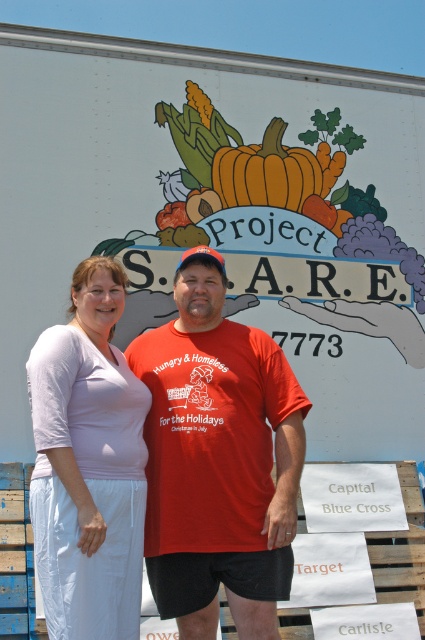
Which is above, pale pink fabric shirt at center or orange matte pumpkin at center?

orange matte pumpkin at center is above.

Is point (136, 576) positioned after point (294, 180)?

No.

Is point (30, 378) positioned in front of point (275, 170)?

Yes, point (30, 378) is closer to viewer.

The height and width of the screenshot is (640, 425). Identify the location of pale pink fabric shirt at center. (87, 465).

Which is behind, point (286, 540) or point (255, 173)?

The point (255, 173) is more distant.

The image size is (425, 640). What do you see at coordinates (218, 460) in the screenshot?
I see `matte red t-shirt at center` at bounding box center [218, 460].

Is point (150, 572) closer to camera compared to point (280, 198)?

Yes, it is.

Image resolution: width=425 pixels, height=640 pixels. I want to click on matte red t-shirt at center, so (x=218, y=460).

Is matte red t-shirt at center wider than pale pink fabric shirt at center?

Correct, the width of matte red t-shirt at center exceeds that of pale pink fabric shirt at center.

Is point (274, 428) farther from viewer compared to point (96, 371)?

Yes, point (274, 428) is behind point (96, 371).

Locate an element on the screen. This screenshot has width=425, height=640. matte red t-shirt at center is located at coordinates (218, 460).